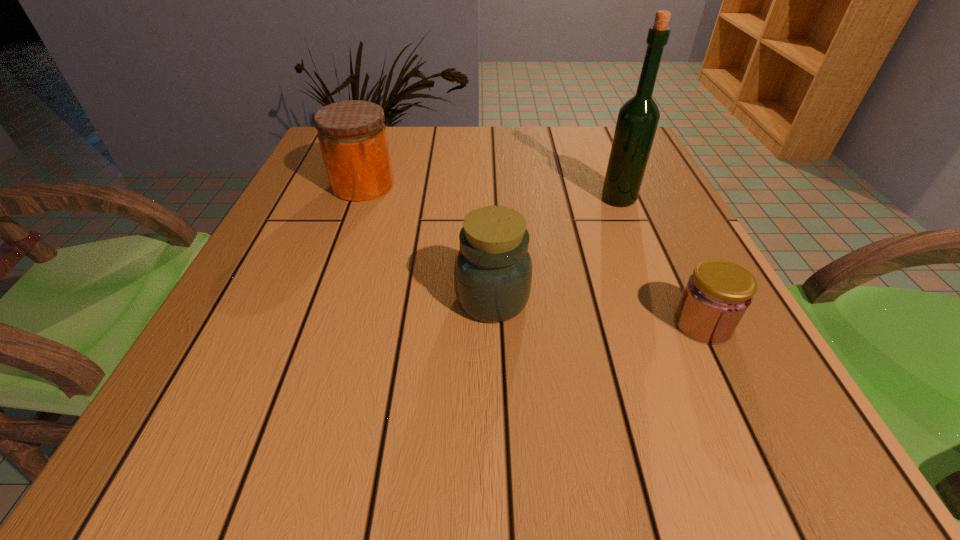
This screenshot has height=540, width=960. I want to click on vacant space in between the shortest object and the leftmost object, so click(533, 254).

At what (x,y) coordinates should I click in order to perform the action: click on free space between the farther jar and the shortest object. Please return your answer as a coordinate pair (x, y). This screenshot has width=960, height=540. Looking at the image, I should click on (533, 254).

Where is `object that is the third closest one to the nearer jar`? Image resolution: width=960 pixels, height=540 pixels. object that is the third closest one to the nearer jar is located at coordinates (352, 135).

Locate which object is the second closest to the farther jar. Please provide its 2D coordinates. Your answer should be formatted as a tuple, i.e. [(x, y)], where the tuple contains the x and y coordinates of a point satisfying the conditions above.

[(638, 118)]

Identify the location of vacant position in the image that satisfies the following two spatial constraints: 1. on the front side of the jam; 2. on the right side of the liquor. (670, 323).

The image size is (960, 540). In order to click on free spot that satisfies the following two spatial constraints: 1. on the back side of the right jar; 2. on the right side of the liquor in this screenshot , I will do `click(490, 199)`.

Find the location of a particular element. The image size is (960, 540). blank area in the image that satisfies the following two spatial constraints: 1. on the front side of the farther jar; 2. on the right side of the nearer jar is located at coordinates (322, 299).

Where is `vacant area in the image that satisfies the following two spatial constraints: 1. on the front side of the liquor; 2. on the right side of the leftmost object`? Image resolution: width=960 pixels, height=540 pixels. vacant area in the image that satisfies the following two spatial constraints: 1. on the front side of the liquor; 2. on the right side of the leftmost object is located at coordinates (358, 199).